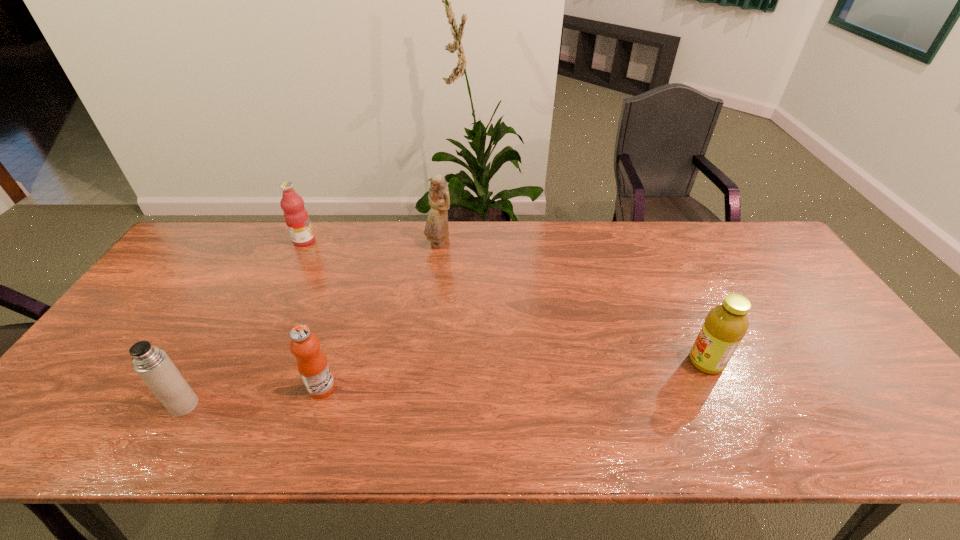
You are a GUI agent. You are given a task and a screenshot of the screen. Output one action in this format:
    pyautogui.click(x=<x>, y=<y>)
    Task: Click on the vacant space that is in between the thermos bottle and the rightmost fruit juice
    The height and width of the screenshot is (540, 960).
    Given the screenshot: What is the action you would take?
    pyautogui.click(x=445, y=384)

I want to click on unoccupied area between the third object from left to right and the thermos bottle, so click(253, 396).

Identify the location of vacant space in between the third object from right to left and the leftmost object. This screenshot has width=960, height=540. (253, 396).

Locate which object is the closest to the rightmost fruit juice. Please provide its 2D coordinates. Your answer should be formatted as a tuple, i.e. [(x, y)], where the tuple contains the x and y coordinates of a point satisfying the conditions above.

[(436, 229)]

Locate which object ranks fourth in proximity to the second fruit juice from right to left. Please provide its 2D coordinates. Your answer should be formatted as a tuple, i.e. [(x, y)], where the tuple contains the x and y coordinates of a point satisfying the conditions above.

[(725, 325)]

What are the coordinates of `fruit juice that is the closest to the second fruit juice from left to right` in the screenshot? It's located at (296, 217).

In order to click on fruit juice that is the closest to the second fruit juice from left to right in this screenshot , I will do `click(296, 217)`.